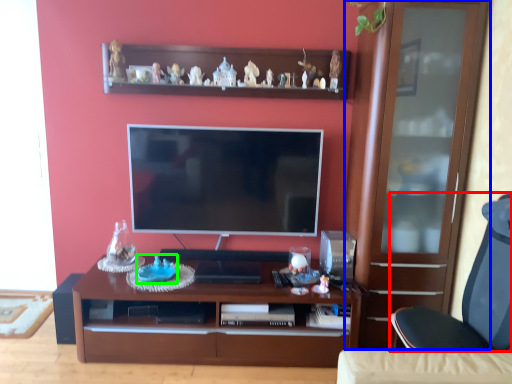
Question: Based on their relative distances, which object is nearer to chair (highlighted by a red box)? Choose from cabinetry (highlighted by a blue box) and toy (highlighted by a green box).

Choices:
 (A) cabinetry
 (B) toy

Answer: (A)